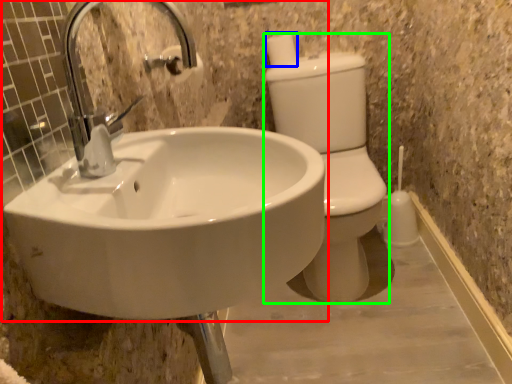
Question: Which is nearer to the sink (highlighted by a red box)? toilet paper (highlighted by a blue box) or toilet bowl (highlighted by a green box).

Choices:
 (A) toilet paper
 (B) toilet bowl

Answer: (B)